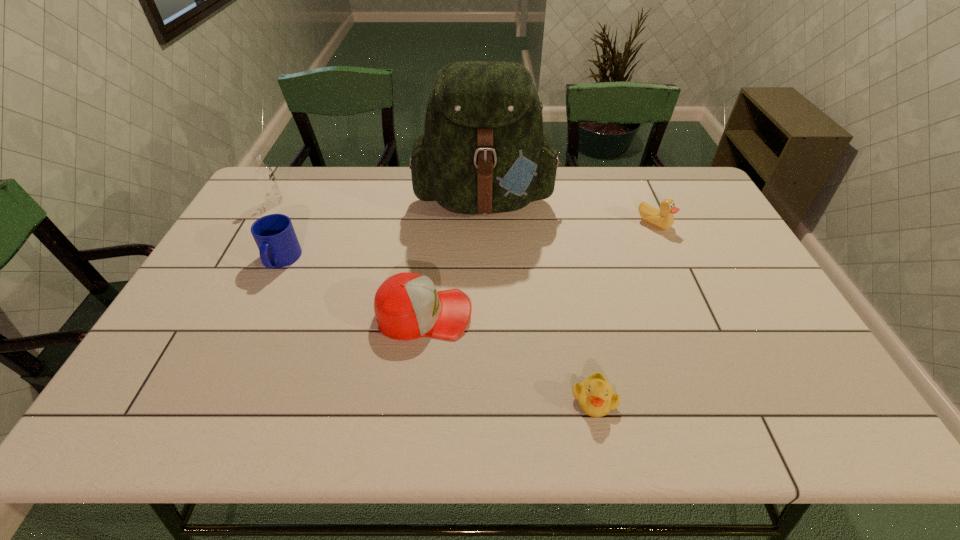
Find the location of a particular element. Image resolution: width=960 pixels, height=540 pixels. vacant region located on the front label of the vodka is located at coordinates (301, 202).

Identify the location of free space located 0.190m on the side with the handle of the second object from left to right. (247, 333).

Locate an element on the screen. This screenshot has width=960, height=540. free point located on the front-facing side of the baseball cap is located at coordinates (553, 314).

Find the location of a particular element. This screenshot has width=960, height=540. vacant space positioned 0.150m at the beak of the duck is located at coordinates (673, 267).

The width and height of the screenshot is (960, 540). I want to click on backpack located in the far edge section of the desktop, so click(483, 151).

Locate an element on the screen. Image resolution: width=960 pixels, height=540 pixels. vodka at the far edge is located at coordinates (264, 174).

This screenshot has height=540, width=960. What are the coordinates of `object that is positioned at the near edge` in the screenshot? It's located at (595, 396).

At what (x,y) coordinates should I click in order to perform the action: click on vodka that is at the left edge. Please return your answer as a coordinate pair (x, y). The image size is (960, 540). Looking at the image, I should click on (264, 174).

The image size is (960, 540). I want to click on mug at the left edge, so click(278, 245).

This screenshot has width=960, height=540. In order to click on object that is at the far left corner in this screenshot , I will do `click(264, 174)`.